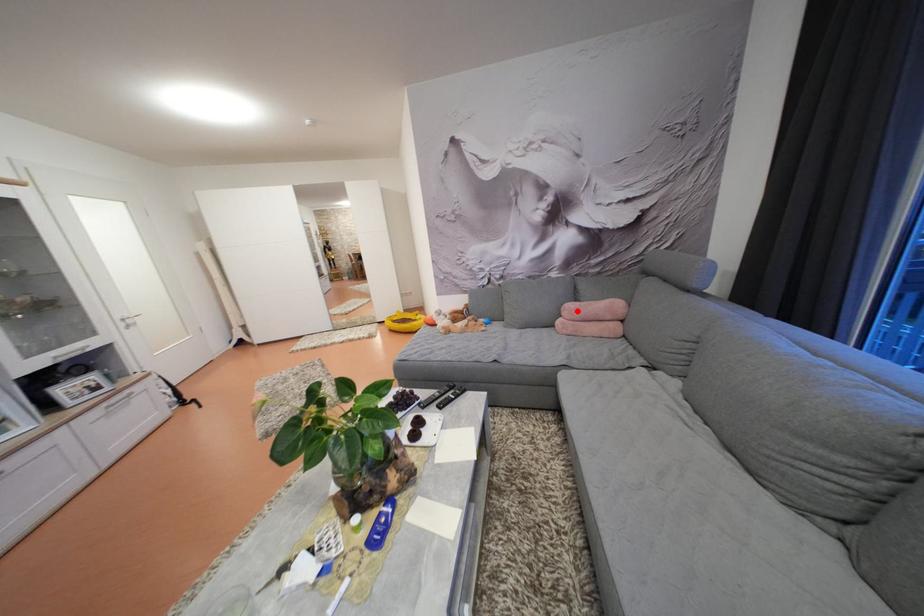
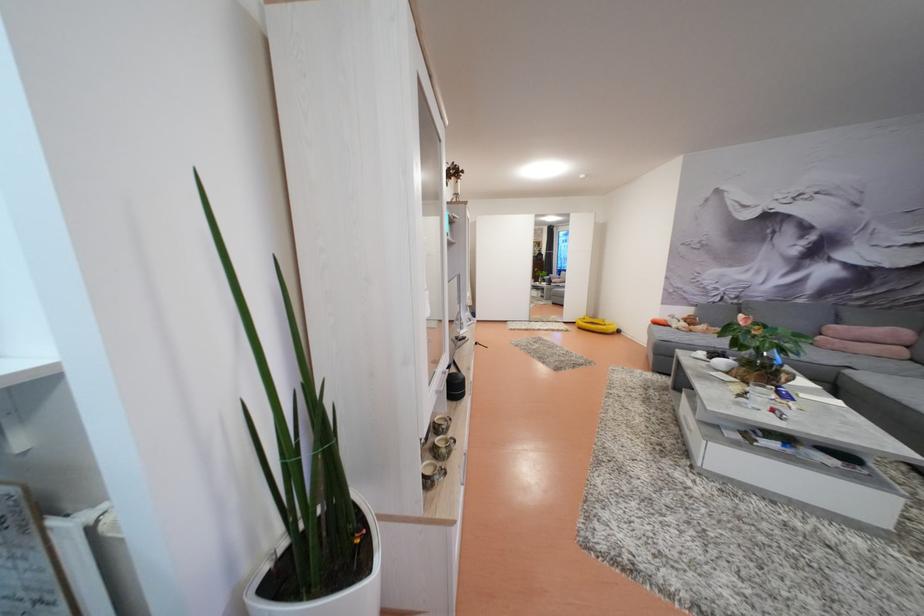
The point at the highlighted location is marked in the first image. Where is the corresponding point in the second image?

(841, 333)